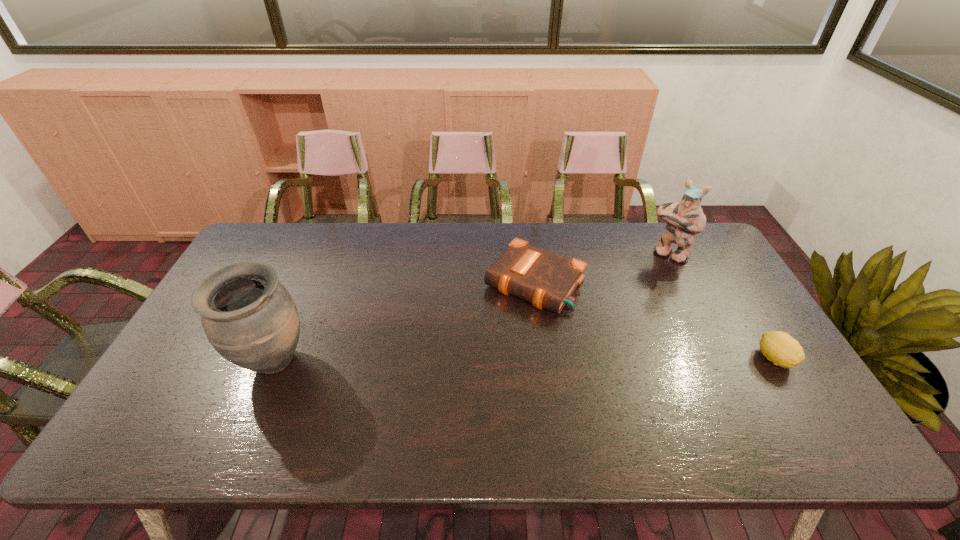
Locate an element on the screen. blank region between the lemon and the Bible is located at coordinates (655, 321).

Locate an element on the screen. This screenshot has height=540, width=960. vacant space that's between the rightmost object and the figurine is located at coordinates (722, 306).

Identify the location of free area in between the Bible and the lemon. The height and width of the screenshot is (540, 960). (655, 321).

Find the location of a particular element. This screenshot has height=540, width=960. free space between the second object from right to left and the leftmost object is located at coordinates (471, 308).

Where is `free area in between the leftmost object and the third object from left to right`? free area in between the leftmost object and the third object from left to right is located at coordinates (471, 308).

Identify which object is located as the nearest to the urn. Please provide its 2D coordinates. Your answer should be formatted as a tuple, i.e. [(x, y)], where the tuple contains the x and y coordinates of a point satisfying the conditions above.

[(547, 280)]

Identify which object is the second nearest to the third object from left to right. Please provide its 2D coordinates. Your answer should be formatted as a tuple, i.e. [(x, y)], where the tuple contains the x and y coordinates of a point satisfying the conditions above.

[(780, 348)]

This screenshot has width=960, height=540. What are the coordinates of `vacant area in the image that satisfies the following two spatial constraints: 1. on the back side of the Bible; 2. on the left side of the figurine` in the screenshot? It's located at (531, 253).